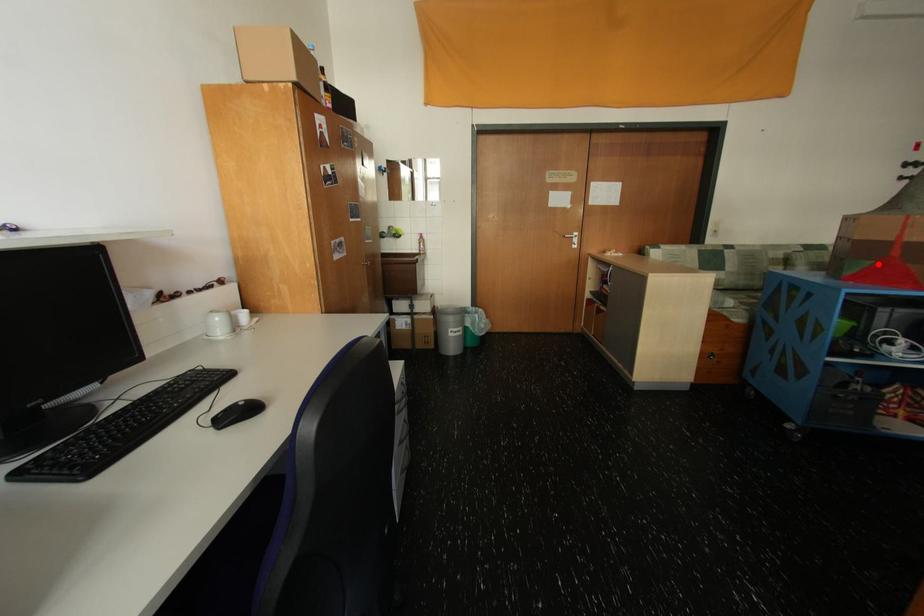
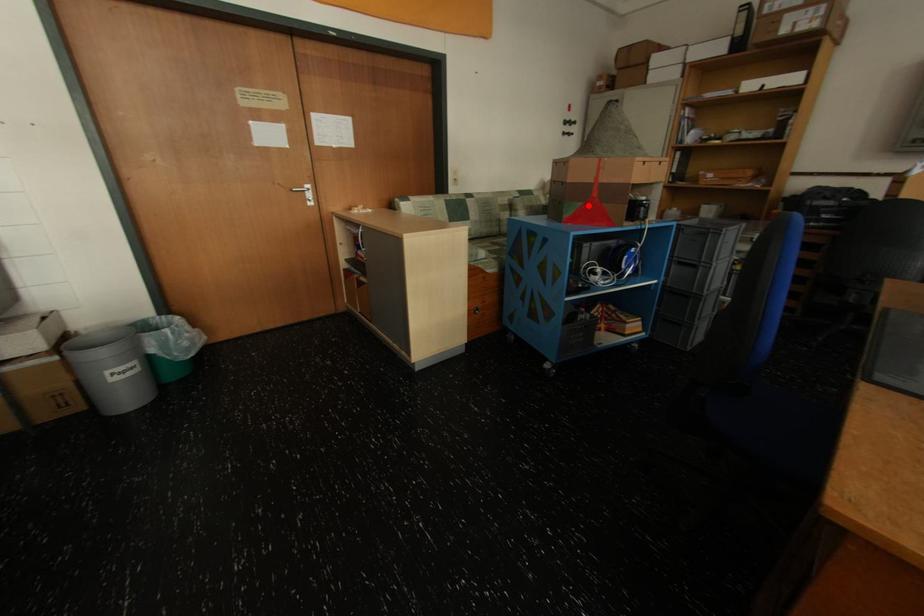
I am providing you with two images of the same scene from different viewpoints. A red point is marked on the first image and another point is marked on the second image. Does the point marked in image1 correspond to the same location as the one in image2?

Yes